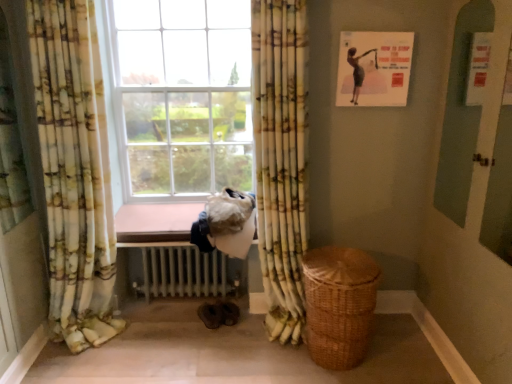
Question: Considering the relative sizes of floral fabric curtain at left, arranged as the second curtain when viewed from the right, and brown wooden window sill at center in the image provided, is floral fabric curtain at left, arranged as the second curtain when viewed from the right, wider than brown wooden window sill at center?

Choices:
 (A) no
 (B) yes

Answer: (A)

Question: Is brown wooden window sill at center inside floral fabric curtain at left, arranged as the second curtain when viewed from the right?

Choices:
 (A) no
 (B) yes

Answer: (A)

Question: From a real-world perspective, is floral fabric curtain at left, which appears as the 1th curtain when viewed from the left, below brown wooden window sill at center?

Choices:
 (A) yes
 (B) no

Answer: (B)

Question: Is brown wooden window sill at center at the back of floral fabric curtain at left, which appears as the 1th curtain when viewed from the left?

Choices:
 (A) no
 (B) yes

Answer: (A)

Question: From a real-world perspective, is floral fabric curtain at left, which appears as the 1th curtain when viewed from the left, positioned over brown wooden window sill at center based on gravity?

Choices:
 (A) no
 (B) yes

Answer: (B)

Question: Is the position of floral fabric curtain at left, which appears as the 1th curtain when viewed from the left, less distant than that of brown wooden window sill at center?

Choices:
 (A) no
 (B) yes

Answer: (B)

Question: Could brown wooden window sill at center be considered to be inside white metallic radiator at lower center?

Choices:
 (A) no
 (B) yes

Answer: (A)

Question: Is white metallic radiator at lower center at the left side of brown wooden window sill at center?

Choices:
 (A) no
 (B) yes

Answer: (B)

Question: Is white metallic radiator at lower center next to brown wooden window sill at center and touching it?

Choices:
 (A) yes
 (B) no

Answer: (B)

Question: Is white metallic radiator at lower center thinner than brown wooden window sill at center?

Choices:
 (A) no
 (B) yes

Answer: (A)

Question: From the image's perspective, does white metallic radiator at lower center appear higher than brown wooden window sill at center?

Choices:
 (A) yes
 (B) no

Answer: (B)

Question: From a real-world perspective, is white metallic radiator at lower center over brown wooden window sill at center?

Choices:
 (A) yes
 (B) no

Answer: (B)

Question: From a real-world perspective, is yellow-green floral fabric curtain at center, which is the 2th curtain in left-to-right order, located higher than woven brown basket at lower right?

Choices:
 (A) no
 (B) yes

Answer: (B)